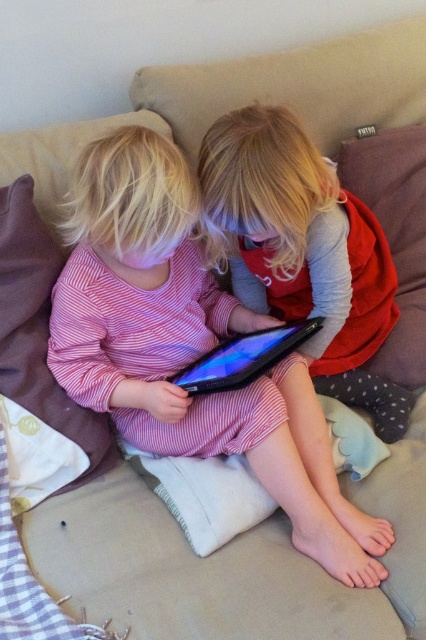
Can you confirm if pink striped dress at center is taller than matte black tablet at center?

Indeed, pink striped dress at center has a greater height compared to matte black tablet at center.

Who is more distant from viewer, (x=51, y=362) or (x=354, y=394)?

The point (x=354, y=394) is behind.

Image resolution: width=426 pixels, height=640 pixels. What are the coordinates of `pink striped dress at center` in the screenshot? It's located at (187, 348).

Does matte black tablet at center appear on the left side of black matte tablet at center?

In fact, matte black tablet at center is to the right of black matte tablet at center.

You are a GUI agent. You are given a task and a screenshot of the screen. Output one action in this format:
    pyautogui.click(x=<x>, y=<y>)
    Task: Click on the matte black tablet at center
    This screenshot has width=426, height=640.
    Given the screenshot: What is the action you would take?
    pyautogui.click(x=304, y=252)

What do you see at coordinates (304, 252) in the screenshot? The image size is (426, 640). I see `matte black tablet at center` at bounding box center [304, 252].

Find the location of `matte black tablet at center`. matte black tablet at center is located at coordinates (304, 252).

Does pink striped dress at center have a greater width compared to black matte tablet at center?

Yes, pink striped dress at center is wider than black matte tablet at center.

Between point (160, 301) and point (221, 365), which one is positioned behind?

The point (160, 301) is behind.

You are a GUI agent. You are given a task and a screenshot of the screen. Output one action in this format:
    pyautogui.click(x=<x>, y=<y>)
    Task: Click on the pink striped dress at center
    The height and width of the screenshot is (640, 426).
    Given the screenshot: What is the action you would take?
    pyautogui.click(x=187, y=348)